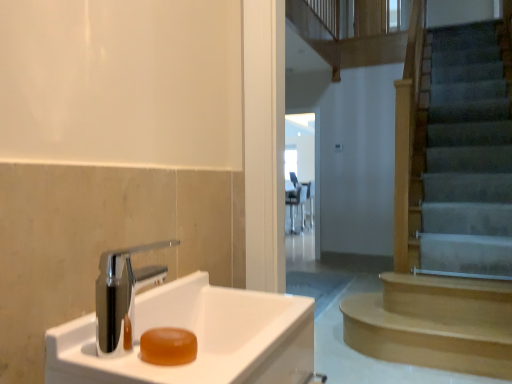
This screenshot has height=384, width=512. Identify the location of free point to the left of translucent amber soap at sink left. (101, 351).